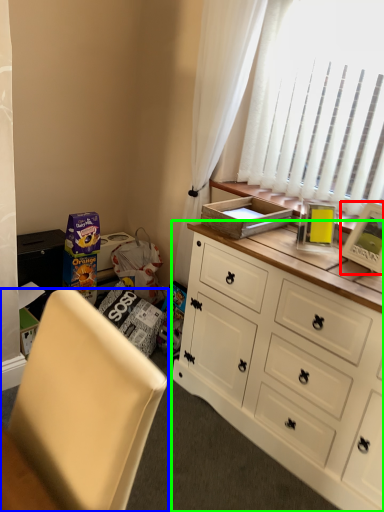
Question: Which object is the closest to the picture frame (highlighted by a red box)? Choose among these: chair (highlighted by a blue box) or cabinetry (highlighted by a green box).

Choices:
 (A) chair
 (B) cabinetry

Answer: (B)